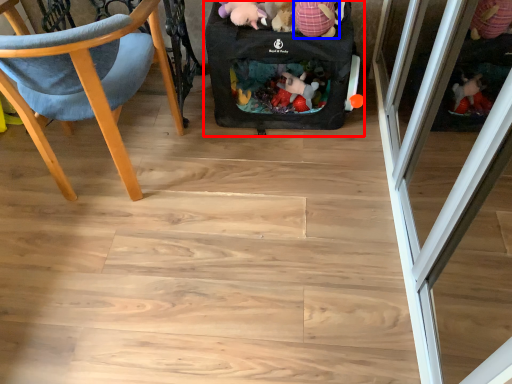
Question: Which of the following is the closest to the observer, baby carriage (highlighted by a red box) or toy (highlighted by a blue box)?

Choices:
 (A) baby carriage
 (B) toy

Answer: (B)